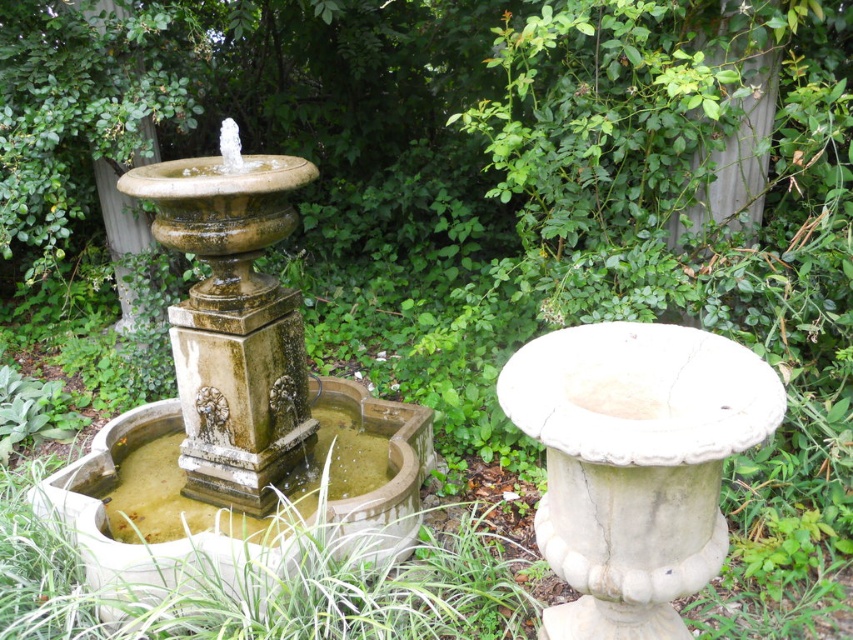
You are planning to place a new decorative statue in the garden. The statue requires a base that can support its weight. Given the scene, which object between the speckled stone fountain at center and the white marble urn at center would be more suitable as a base for the statue?

The speckled stone fountain at center has a larger size compared to the white marble urn at center, making it more suitable as a base for the statue due to its greater stability and capacity to bear weight.